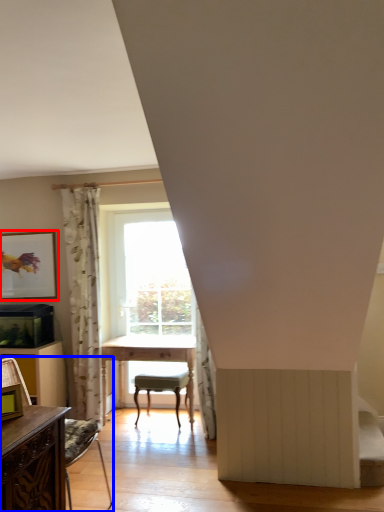
Question: Among these objects, which one is nearest to the camera, picture frame (highlighted by a red box) or chair (highlighted by a blue box)?

Choices:
 (A) picture frame
 (B) chair

Answer: (B)